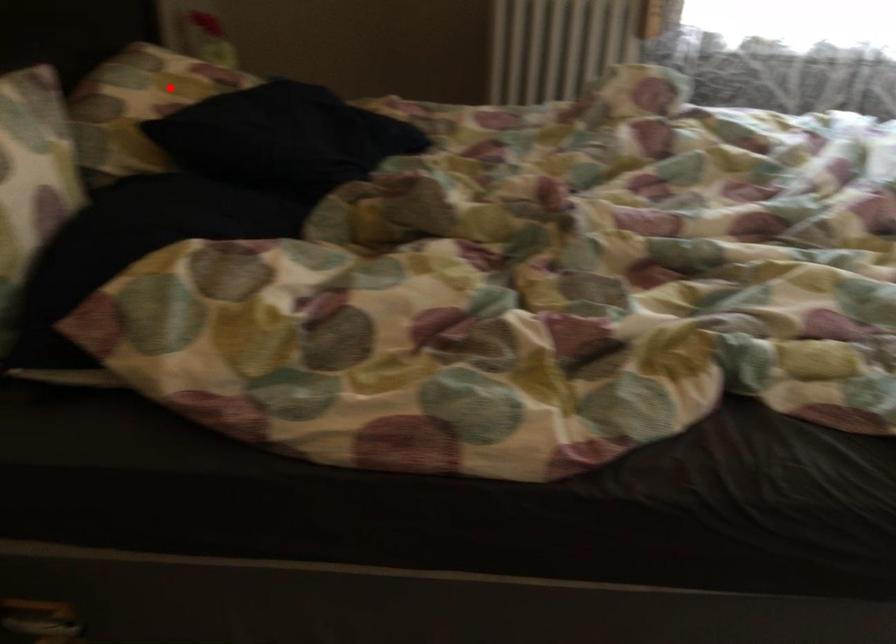
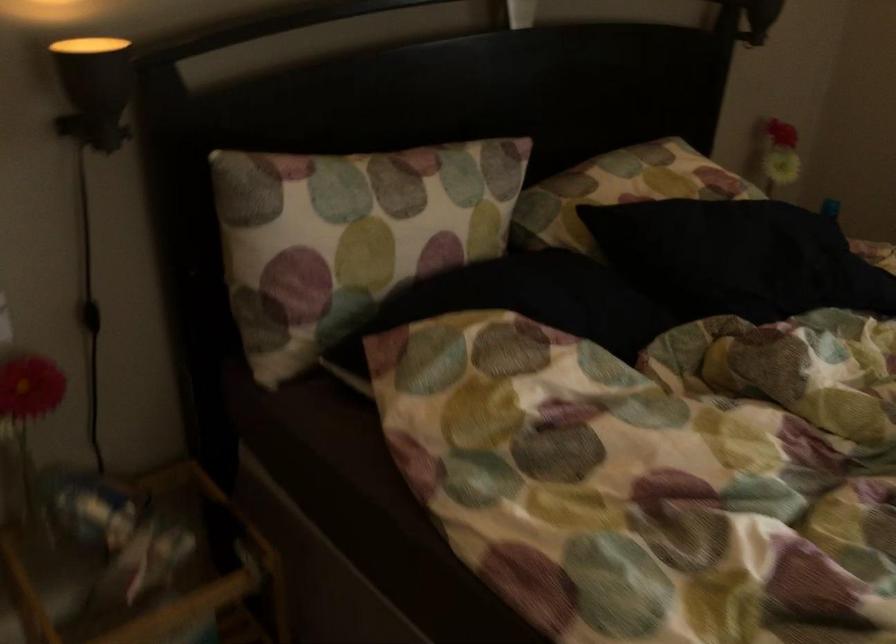
The point at the highlighted location is marked in the first image. Where is the corresponding point in the second image?

(649, 176)